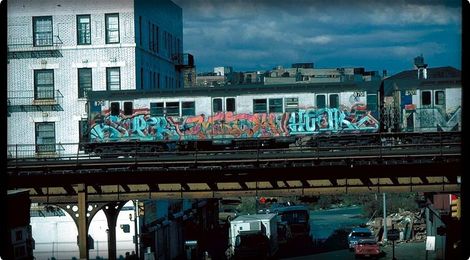
Locate an element on the screen. wooden supports is located at coordinates (79, 208), (110, 213).